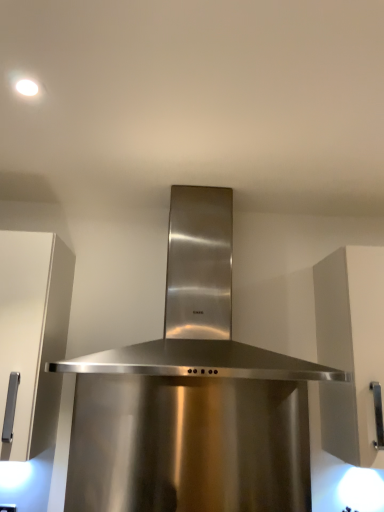
Question: Is stainless steel range hood at center shorter than white matte cabinet at right?

Choices:
 (A) yes
 (B) no

Answer: (A)

Question: Is stainless steel range hood at center positioned before white matte cabinet at right?

Choices:
 (A) no
 (B) yes

Answer: (B)

Question: Is stainless steel range hood at center located outside white matte cabinet at right?

Choices:
 (A) no
 (B) yes

Answer: (B)

Question: Is stainless steel range hood at center to the left of white matte cabinet at right from the viewer's perspective?

Choices:
 (A) no
 (B) yes

Answer: (B)

Question: From the image's perspective, is stainless steel range hood at center located above white matte cabinet at right?

Choices:
 (A) no
 (B) yes

Answer: (B)

Question: Can you confirm if stainless steel range hood at center is bigger than white matte cabinet at right?

Choices:
 (A) yes
 (B) no

Answer: (A)

Question: From the image's perspective, would you say white matte cabinet at right is shown under stainless steel range hood at center?

Choices:
 (A) yes
 (B) no

Answer: (A)

Question: Is white matte cabinet at right next to stainless steel range hood at center?

Choices:
 (A) no
 (B) yes

Answer: (A)

Question: Is white matte cabinet at right turned away from stainless steel range hood at center?

Choices:
 (A) yes
 (B) no

Answer: (B)

Question: Is white matte cabinet at right further to the viewer compared to stainless steel range hood at center?

Choices:
 (A) no
 (B) yes

Answer: (B)

Question: Is white matte cabinet at right not within stainless steel range hood at center?

Choices:
 (A) no
 (B) yes

Answer: (B)

Question: Is white matte cabinet at right smaller than stainless steel range hood at center?

Choices:
 (A) yes
 (B) no

Answer: (A)

Question: Considering the positions of stainless steel range hood at center and white matte cabinet at right in the image, is stainless steel range hood at center wider or thinner than white matte cabinet at right?

Choices:
 (A) thin
 (B) wide

Answer: (B)